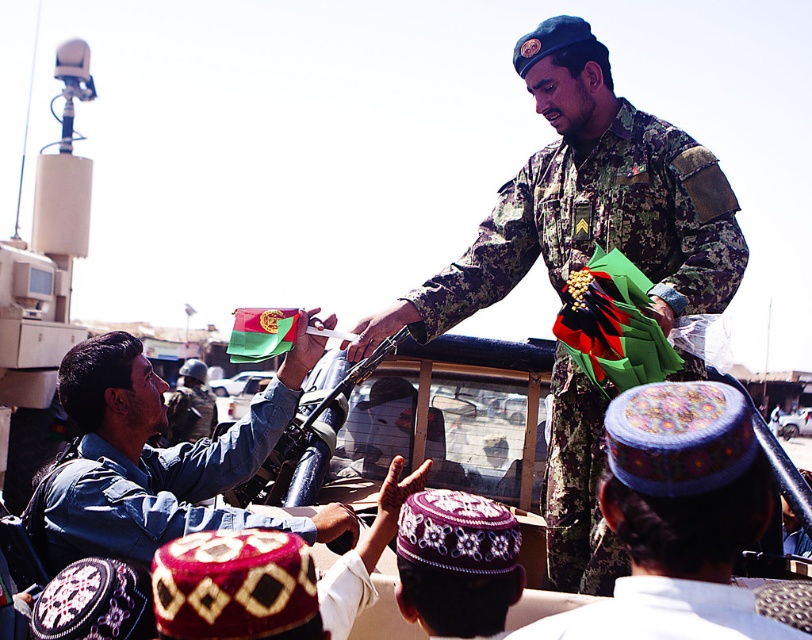
You are a photographer at the event and need to frame a closeup shot of the purple embroidered cap at center and the metallic silver vehicle at center in the same frame. Given their sizes, will the cap appear smaller than the vehicle in the photo?

The purple embroidered cap at center is less wide than the metallic silver vehicle at center, so yes, the cap will appear smaller than the vehicle in the photo.

You are standing in the scene and want to move from point (514, 244) to point (189, 406). Which direction should you move to get closer to the seated civilian in the vehicle?

To move from point (514, 244) to point (189, 406), you should move downward and to the right since point (189, 406) is located below and to the right of point (514, 244).